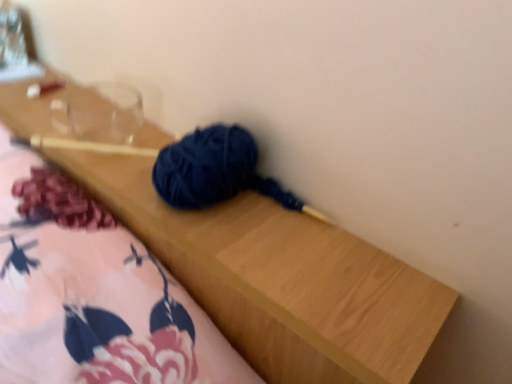
Question: Is transparent glass jar at upper left thinner than fluffy pink blanket at lower left?

Choices:
 (A) no
 (B) yes

Answer: (B)

Question: From a real-world perspective, is transparent glass jar at upper left located beneath fluffy pink blanket at lower left?

Choices:
 (A) no
 (B) yes

Answer: (A)

Question: Does transparent glass jar at upper left turn towards fluffy pink blanket at lower left?

Choices:
 (A) yes
 (B) no

Answer: (B)

Question: From the image's perspective, is transparent glass jar at upper left located beneath fluffy pink blanket at lower left?

Choices:
 (A) no
 (B) yes

Answer: (A)

Question: Would you say transparent glass jar at upper left is a long distance from fluffy pink blanket at lower left?

Choices:
 (A) yes
 (B) no

Answer: (B)

Question: Does point (44, 309) appear closer or farther from the camera than point (72, 129)?

Choices:
 (A) farther
 (B) closer

Answer: (B)

Question: Considering their positions, is fluffy pink blanket at lower left located in front of or behind transparent glass at upper left?

Choices:
 (A) behind
 (B) front

Answer: (B)

Question: From a real-world perspective, is fluffy pink blanket at lower left above or below transparent glass at upper left?

Choices:
 (A) below
 (B) above

Answer: (A)

Question: In terms of size, does fluffy pink blanket at lower left appear bigger or smaller than transparent glass at upper left?

Choices:
 (A) big
 (B) small

Answer: (A)

Question: Is point (79, 125) positioned closer to the camera than point (4, 34)?

Choices:
 (A) closer
 (B) farther

Answer: (A)

Question: From a real-world perspective, relative to transparent glass jar at upper left, is transparent glass at upper left vertically above or below?

Choices:
 (A) above
 (B) below

Answer: (B)

Question: Considering the positions of transparent glass at upper left and transparent glass jar at upper left in the image, is transparent glass at upper left wider or thinner than transparent glass jar at upper left?

Choices:
 (A) thin
 (B) wide

Answer: (A)

Question: Is transparent glass at upper left taller or shorter than transparent glass jar at upper left?

Choices:
 (A) short
 (B) tall

Answer: (A)

Question: Based on their positions, is transparent glass jar at upper left located to the left or right of transparent glass at upper left?

Choices:
 (A) right
 (B) left

Answer: (B)

Question: From a real-world perspective, relative to transparent glass at upper left, is transparent glass jar at upper left vertically above or below?

Choices:
 (A) below
 (B) above

Answer: (B)